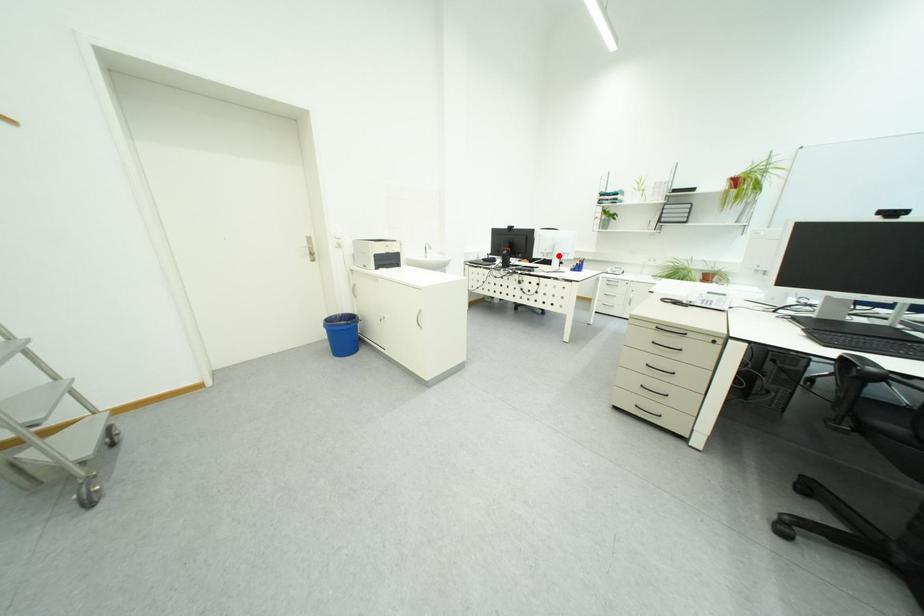
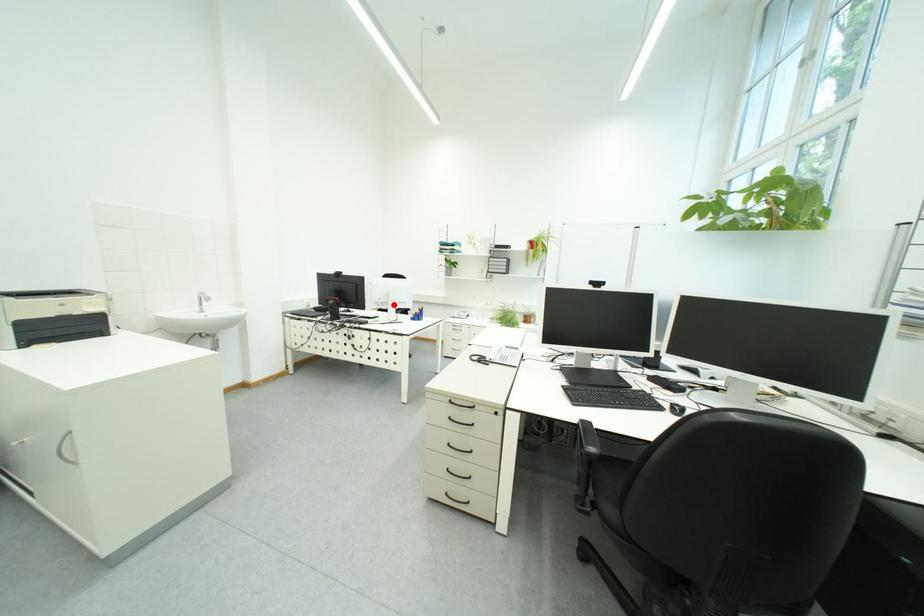
I am providing you with two images of the same scene from different viewpoints. A red point is marked on the first image and another point is marked on the second image. Is the marked point in image1 the same physical position as the marked point in image2?

Yes